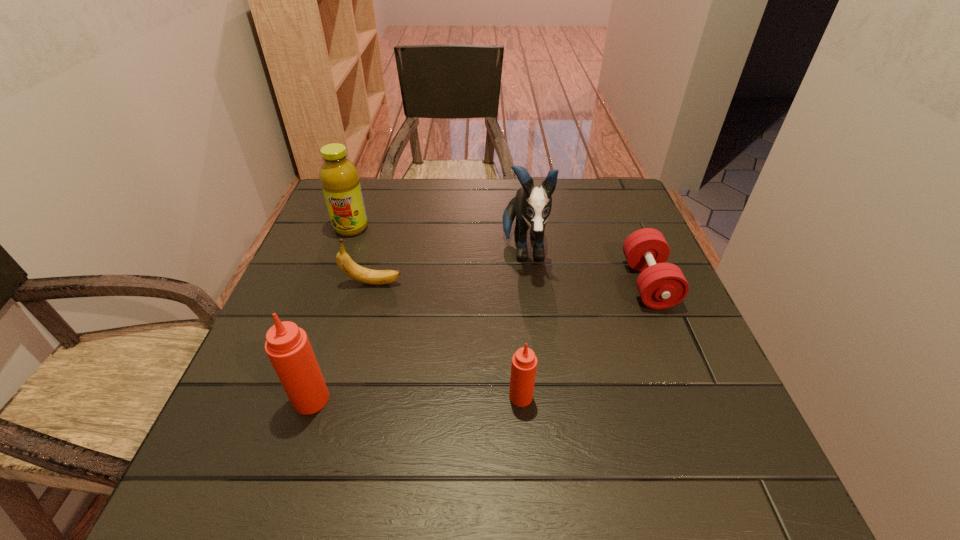
Identify the location of the left Tabasco sauce. This screenshot has height=540, width=960. (288, 348).

Locate an element on the screen. The width and height of the screenshot is (960, 540). the right Tabasco sauce is located at coordinates (524, 362).

You are a GUI agent. You are given a task and a screenshot of the screen. Output one action in this format:
    pyautogui.click(x=<x>, y=<y>)
    Task: Click on the fruit juice
    This screenshot has height=540, width=960.
    Given the screenshot: What is the action you would take?
    pyautogui.click(x=339, y=178)

At what (x,y) coordinates should I click in order to perform the action: click on the tallest object. Please return your answer as a coordinate pair (x, y). This screenshot has width=960, height=540. Looking at the image, I should click on (531, 206).

I want to click on the shortest object, so click(x=661, y=285).

Locate an element on the screen. This screenshot has height=540, width=960. dumbbell is located at coordinates (661, 285).

I want to click on banana, so click(x=361, y=274).

Where is `vacant area situated on the back of the left Tabasco sauce`? This screenshot has width=960, height=540. vacant area situated on the back of the left Tabasco sauce is located at coordinates (330, 339).

I want to click on free spot located 0.070m on the right of the right Tabasco sauce, so pos(571,397).

This screenshot has width=960, height=540. I want to click on free space located 0.180m on the front label of the fruit juice, so click(330, 285).